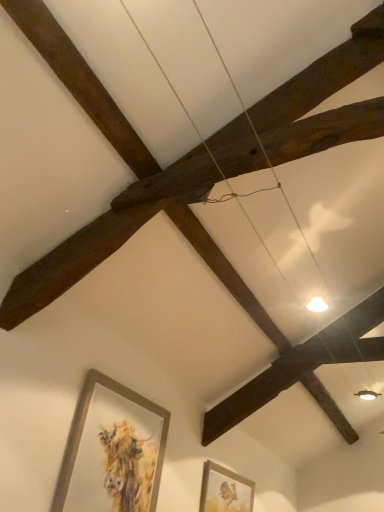
Question: From a real-world perspective, does matte gold picture frame at lower right, arranged as the 2th picture frame when viewed from the top, sit lower than gold metallic picture frame at lower left, placed as the second picture frame when sorted from right to left?

Choices:
 (A) yes
 (B) no

Answer: (A)

Question: Is matte gold picture frame at lower right, which appears as the first picture frame when viewed from the back, positioned in front of gold metallic picture frame at lower left, which is the first picture frame in top-to-bottom order?

Choices:
 (A) yes
 (B) no

Answer: (B)

Question: Does matte gold picture frame at lower right, which is counted as the 1th picture frame, starting from the right, have a smaller size compared to gold metallic picture frame at lower left, which ranks as the first picture frame in front-to-back order?

Choices:
 (A) no
 (B) yes

Answer: (B)

Question: From a real-world perspective, does matte gold picture frame at lower right, arranged as the 2th picture frame when viewed from the top, stand above gold metallic picture frame at lower left, positioned as the 2th picture frame in back-to-front order?

Choices:
 (A) no
 (B) yes

Answer: (A)

Question: Is matte gold picture frame at lower right, which is counted as the 1th picture frame, starting from the right, facing away from gold metallic picture frame at lower left, which ranks as the first picture frame in front-to-back order?

Choices:
 (A) no
 (B) yes

Answer: (A)

Question: Is matte gold picture frame at lower right, arranged as the first picture frame when ordered from the bottom, far from gold metallic picture frame at lower left, placed as the second picture frame when sorted from right to left?

Choices:
 (A) no
 (B) yes

Answer: (B)

Question: From the image's perspective, is gold metallic picture frame at lower left, which appears as the first picture frame when viewed from the left, below matte gold picture frame at lower right, which appears as the first picture frame when viewed from the back?

Choices:
 (A) yes
 (B) no

Answer: (B)

Question: Does gold metallic picture frame at lower left, positioned as the 2th picture frame in back-to-front order, come behind matte gold picture frame at lower right, which ranks as the 2th picture frame in left-to-right order?

Choices:
 (A) yes
 (B) no

Answer: (B)

Question: From a real-world perspective, does gold metallic picture frame at lower left, which is the first picture frame in top-to-bottom order, sit lower than matte gold picture frame at lower right, which is counted as the 1th picture frame, starting from the right?

Choices:
 (A) no
 (B) yes

Answer: (A)

Question: Is gold metallic picture frame at lower left, which ranks as the first picture frame in front-to-back order, to the left of matte gold picture frame at lower right, which ranks as the 2th picture frame in left-to-right order, from the viewer's perspective?

Choices:
 (A) no
 (B) yes

Answer: (B)

Question: Does gold metallic picture frame at lower left, which ranks as the first picture frame in front-to-back order, have a smaller size compared to matte gold picture frame at lower right, which is counted as the 1th picture frame, starting from the right?

Choices:
 (A) yes
 (B) no

Answer: (B)

Question: Considering the relative sizes of gold metallic picture frame at lower left, which appears as the first picture frame when viewed from the left, and matte gold picture frame at lower right, which appears as the first picture frame when viewed from the back, in the image provided, is gold metallic picture frame at lower left, which appears as the first picture frame when viewed from the left, thinner than matte gold picture frame at lower right, which appears as the first picture frame when viewed from the back,?

Choices:
 (A) no
 (B) yes

Answer: (B)

Question: Looking at their shapes, would you say matte gold picture frame at lower right, acting as the second picture frame starting from the front, is wider or thinner than gold metallic picture frame at lower left, which is the first picture frame in top-to-bottom order?

Choices:
 (A) thin
 (B) wide

Answer: (B)